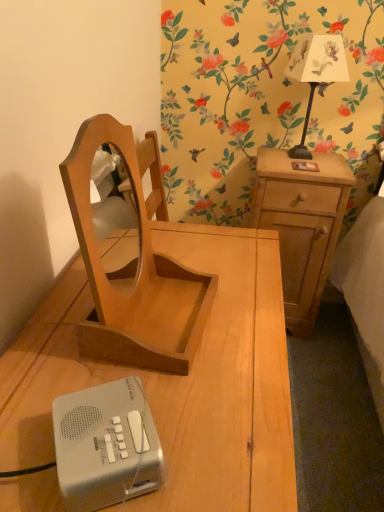
Where is `vacant area that lies between silver plastic radio at lower left and light brown wood mirror at center`? The image size is (384, 512). vacant area that lies between silver plastic radio at lower left and light brown wood mirror at center is located at coordinates (148, 393).